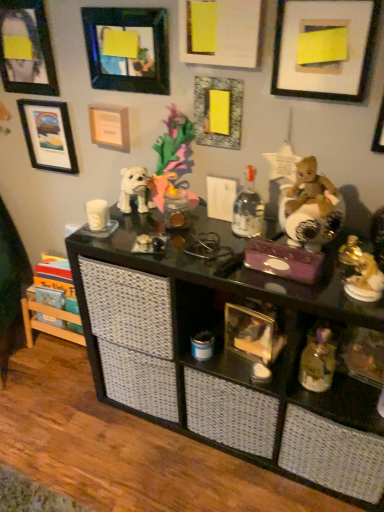
Where is `free space to the left of gold metallic figurine at right, acting as the second toy starting from the top`? This screenshot has width=384, height=512. free space to the left of gold metallic figurine at right, acting as the second toy starting from the top is located at coordinates (308, 281).